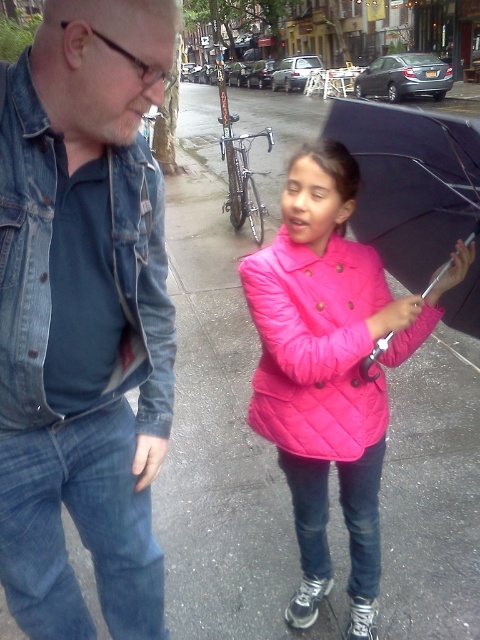
You are a photographer on the sidewalk and want to capture a photo of the black matte umbrella at center without the denim jacket at left blocking the view. Can you adjust your position to do so?

The denim jacket at left is much taller than the black matte umbrella at center, so if you move to a lower angle or position yourself where the jacket is not in the line of sight, you can avoid it blocking the umbrella.

You are a fashion designer observing a rainy day scene. You notice the quilted pink coat at center and the black matte umbrella at center. Which item is larger in size?

The quilted pink coat at center is smaller than black matte umbrella at center, so the black matte umbrella at center is larger in size.